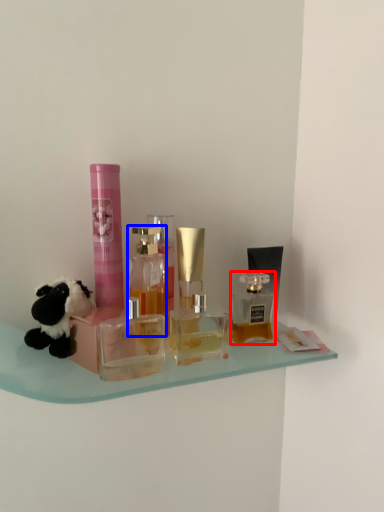
Question: Which object is closer to the camera taking this photo, bottle (highlighted by a red box) or bottle (highlighted by a blue box)?

Choices:
 (A) bottle
 (B) bottle

Answer: (B)